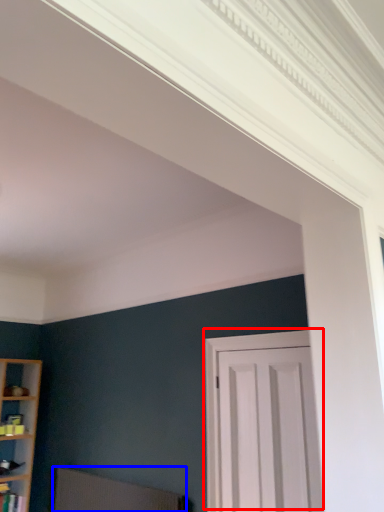
Question: Which point is closer to the camera, door (highlighted by a red box) or swivel chair (highlighted by a blue box)?

Choices:
 (A) door
 (B) swivel chair

Answer: (A)